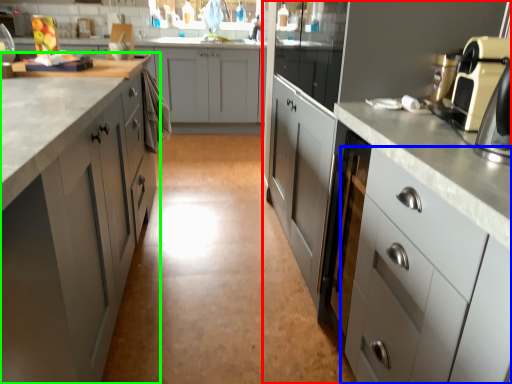
Question: Estimate the real-world distances between objects in this image. Which object is farther from cabinetry (highlighted by a red box), cabinetry (highlighted by a blue box) or cabinetry (highlighted by a green box)?

Choices:
 (A) cabinetry
 (B) cabinetry

Answer: (B)